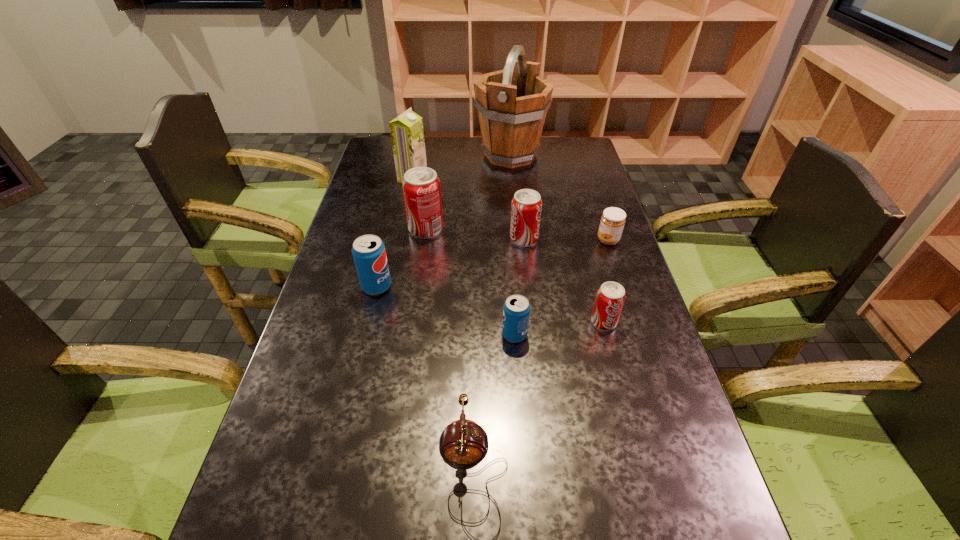
The image size is (960, 540). I want to click on free space at the left edge, so click(380, 178).

Locate an element on the screen. This screenshot has width=960, height=540. vacant space at the right edge of the desktop is located at coordinates (648, 409).

Identify the location of vacant area at the far right corner of the desktop. The image size is (960, 540). (558, 150).

Find the location of a particular element. empty space that is in between the sixth farthest object and the bucket is located at coordinates (444, 221).

I want to click on unoccupied area between the nearest red soda can and the soya milk, so click(508, 251).

In order to click on free space between the third tallest object and the third farthest soda can in this screenshot , I will do tap(401, 258).

Find the location of a particular element. Image resolution: width=960 pixels, height=540 pixels. free space between the tallest object and the tallest soda can is located at coordinates (468, 192).

Locate an element on the screen. The width and height of the screenshot is (960, 540). vacant space in between the right blue soda can and the tallest object is located at coordinates (513, 245).

Locate an element on the screen. Image resolution: width=960 pixels, height=540 pixels. free space between the orange jam and the second smallest red soda can is located at coordinates (566, 240).

Identify which object is the eighth closest to the nearer blue soda can. Please provide its 2D coordinates. Your answer should be formatted as a tuple, i.e. [(x, y)], where the tuple contains the x and y coordinates of a point satisfying the conditions above.

[(512, 103)]